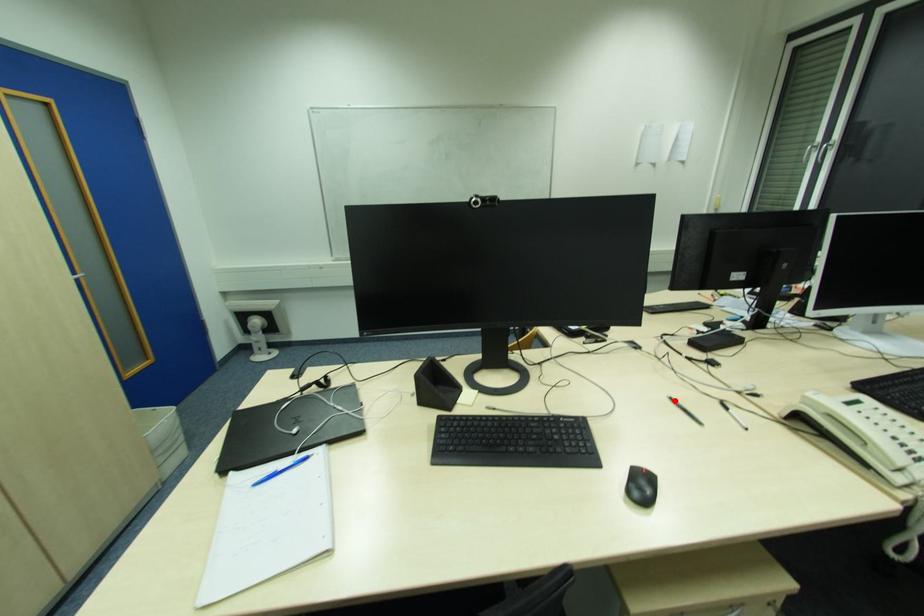
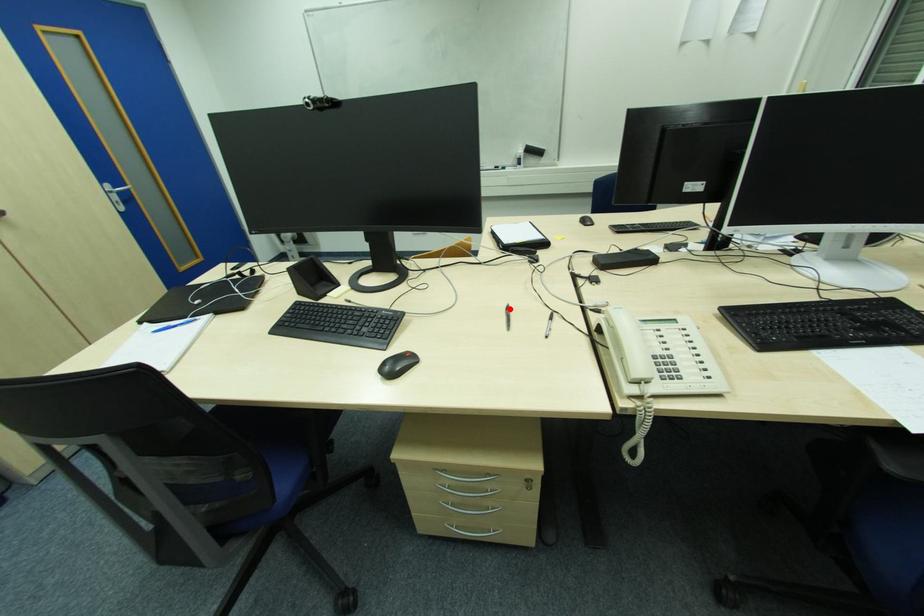
I am providing you with two images of the same scene from different viewpoints. A red point is marked on the first image and another point is marked on the second image. Is the red point in image1 aligned with the point shown in image2?

Yes